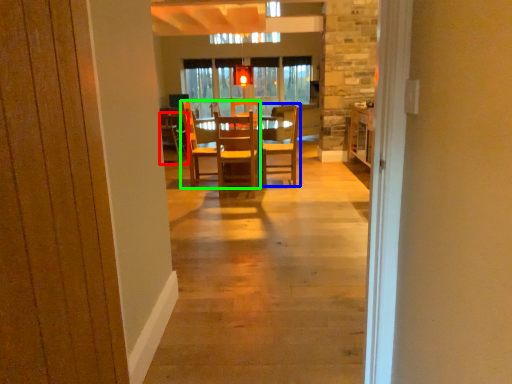
Question: Which is farther away from chair (highlighted by a red box)? chair (highlighted by a blue box) or chair (highlighted by a green box)?

Choices:
 (A) chair
 (B) chair

Answer: (A)